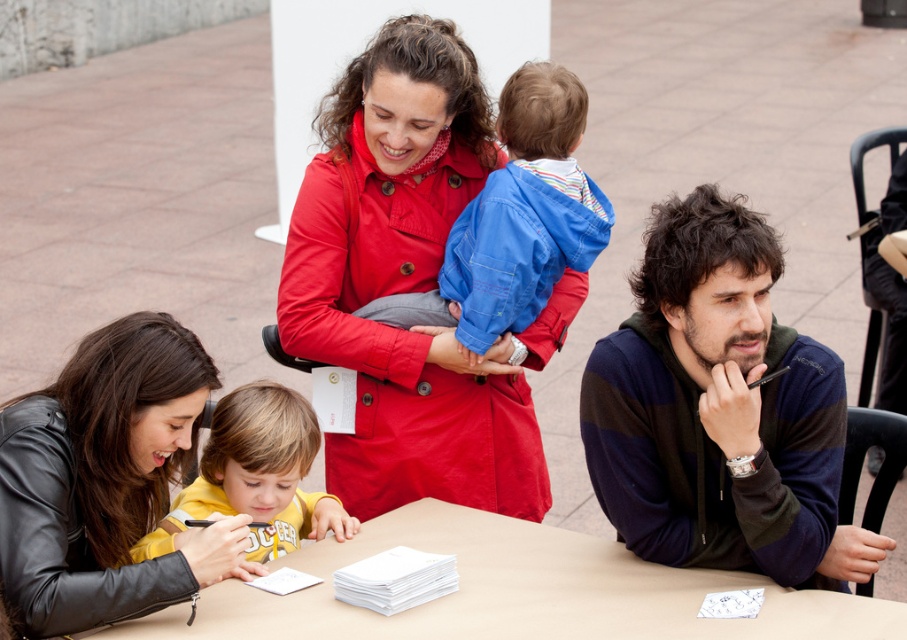
Question: Is the position of blue cotton jacket at center more distant than that of yellow jersey at lower left?

Choices:
 (A) yes
 (B) no

Answer: (A)

Question: Does matte red coat at center have a larger size compared to blue cotton jacket at center?

Choices:
 (A) yes
 (B) no

Answer: (A)

Question: From the image, what is the correct spatial relationship of black leather jacket at lower left in relation to smooth beige table at lower center?

Choices:
 (A) above
 (B) below

Answer: (A)

Question: Based on their relative distances, which object is farther from the blue cotton jacket at center?

Choices:
 (A) yellow jersey at lower left
 (B) matte red coat at center
 (C) smooth beige table at lower center
 (D) dark blue striped hoodie at right

Answer: (C)

Question: Which is nearer to the blue cotton jacket at center?

Choices:
 (A) smooth beige table at lower center
 (B) black leather jacket at lower left

Answer: (A)

Question: Estimate the real-world distances between objects in this image. Which object is farther from the smooth beige table at lower center?

Choices:
 (A) yellow jersey at lower left
 (B) dark blue striped hoodie at right
 (C) matte red coat at center

Answer: (C)